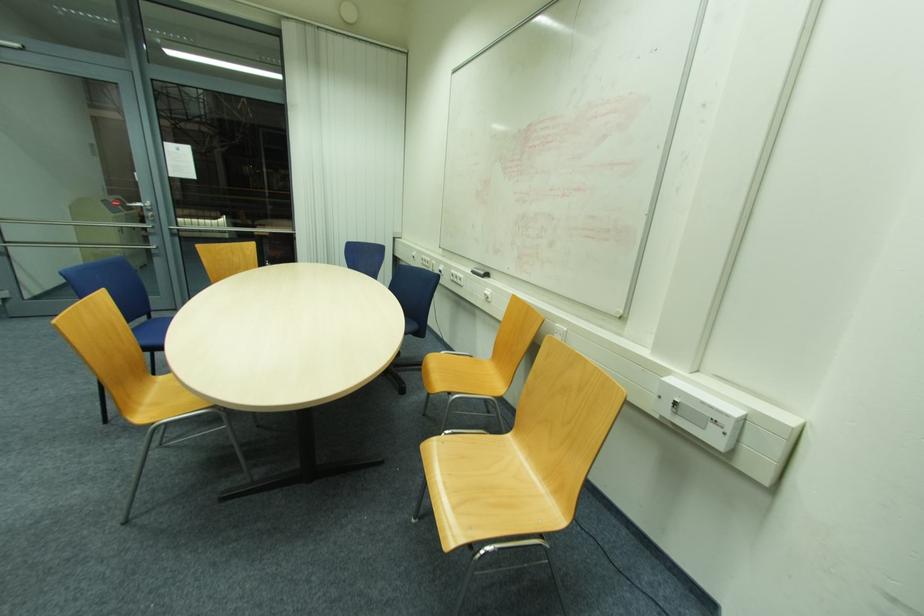
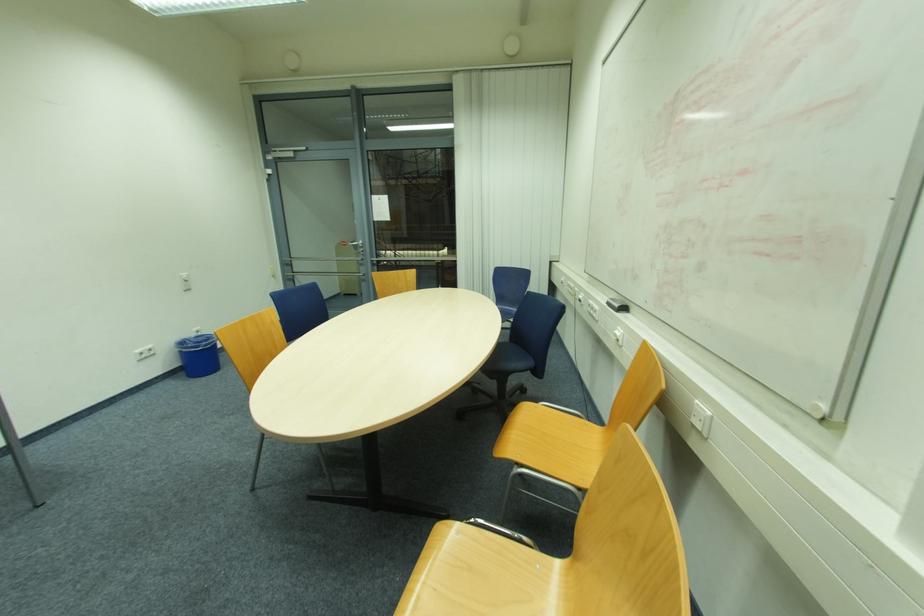
Question: The camera is either moving clockwise (left) or counter-clockwise (right) around the object. The first image is from the beginning of the video and the second image is from the end. Is the camera moving left or right when shooting the video?

Choices:
 (A) Left
 (B) Right

Answer: (B)